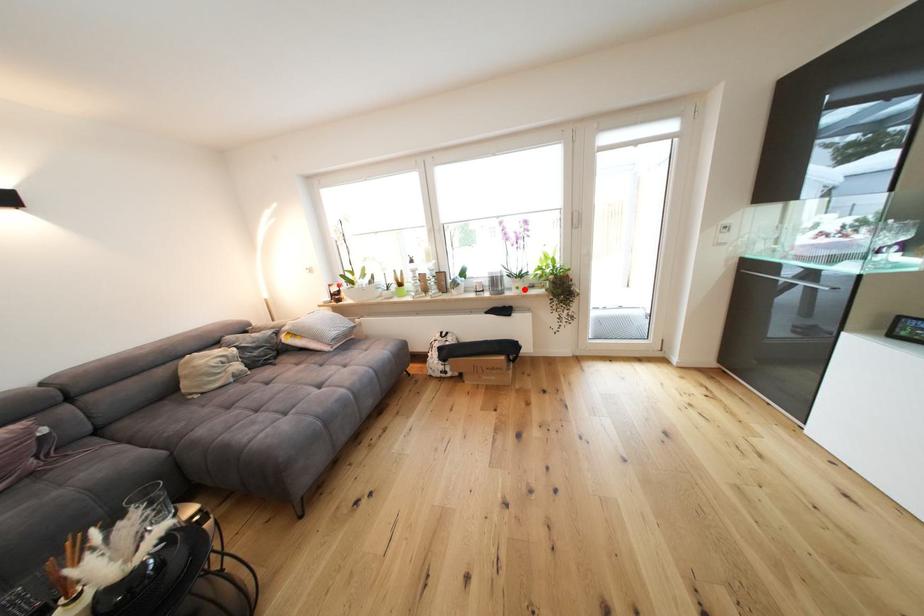
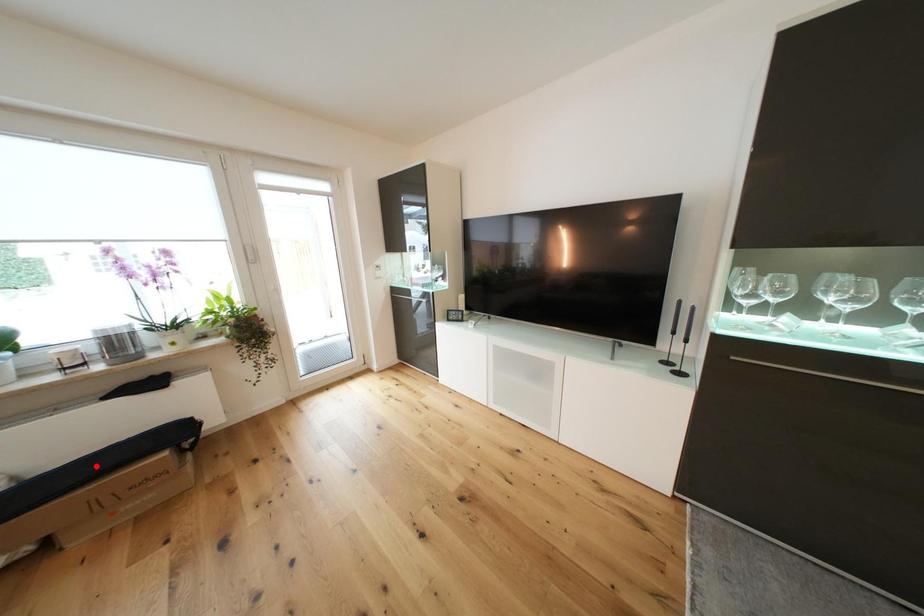
I am providing you with two images of the same scene from different viewpoints. A red point is marked on the first image and another point is marked on the second image. Are the points marked in image1 and image2 representing the same 3D position?

No